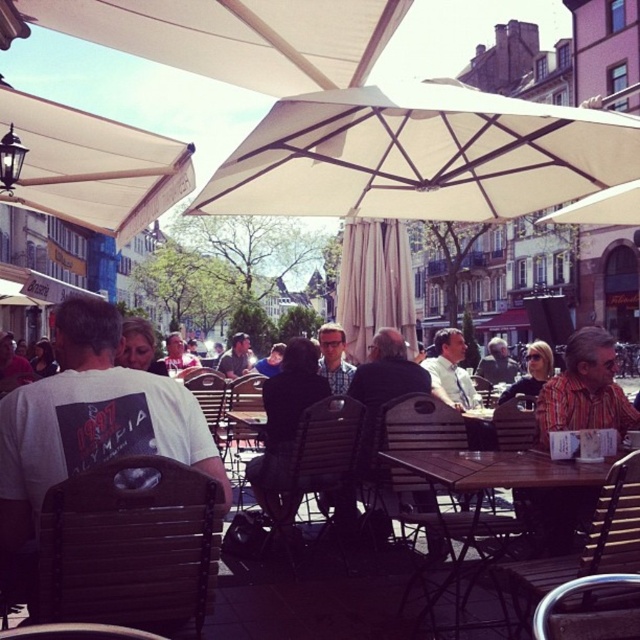
Who is taller, beige fabric umbrella at center or matte black sunglasses at center?

With more height is beige fabric umbrella at center.

Which of these two, beige fabric umbrella at center or matte black sunglasses at center, stands shorter?

matte black sunglasses at center

Describe the element at coordinates (420, 156) in the screenshot. The image size is (640, 640). I see `beige fabric umbrella at center` at that location.

You are a GUI agent. You are given a task and a screenshot of the screen. Output one action in this format:
    pyautogui.click(x=<x>, y=<y>)
    Task: Click on the beige fabric umbrella at center
    The image size is (640, 640).
    Given the screenshot: What is the action you would take?
    pyautogui.click(x=420, y=156)

Who is taller, wooden table at center or matte gray jacket at center?

Standing taller between the two is wooden table at center.

Is wooden table at center in front of matte gray jacket at center?

Yes, it is in front of matte gray jacket at center.

Who is more distant from viewer, (486, 481) or (488, 381)?

The point (488, 381) is behind.

In order to click on wooden table at center in this screenshot , I will do `click(496, 470)`.

This screenshot has width=640, height=640. Find the location of `dark gray fabric jacket at center`. dark gray fabric jacket at center is located at coordinates (284, 419).

Is dark gray fabric jacket at center positioned before matte gray jacket at center?

Yes, it is.

At what (x,y) coordinates should I click in order to perform the action: click on dark gray fabric jacket at center. Please return your answer as a coordinate pair (x, y). The height and width of the screenshot is (640, 640). Looking at the image, I should click on (284, 419).

Locate an element on the screen. This screenshot has height=640, width=640. dark gray fabric jacket at center is located at coordinates (284, 419).